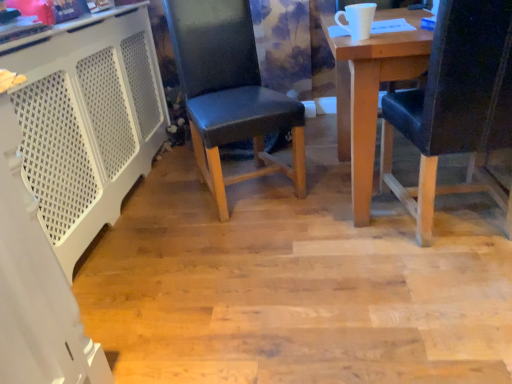
Question: In which direction should I rotate to look at black leather chair at center, placed as the 1th chair when sorted from left to right?

Choices:
 (A) right
 (B) left

Answer: (B)

Question: Is black leather chair at right, the 1th chair in the right-to-left sequence, positioned with its back to black leather chair at center, placed as the 1th chair when sorted from left to right?

Choices:
 (A) yes
 (B) no

Answer: (B)

Question: Is black leather chair at right, which is counted as the 2th chair, starting from the left, at the left side of black leather chair at center, marked as the second chair in a right-to-left arrangement?

Choices:
 (A) no
 (B) yes

Answer: (A)

Question: From a real-world perspective, is black leather chair at right, the 1th chair in the right-to-left sequence, over black leather chair at center, placed as the 1th chair when sorted from left to right?

Choices:
 (A) no
 (B) yes

Answer: (A)

Question: Is black leather chair at right, which is counted as the 2th chair, starting from the left, far away from black leather chair at center, marked as the second chair in a right-to-left arrangement?

Choices:
 (A) no
 (B) yes

Answer: (A)

Question: From the image's perspective, would you say black leather chair at right, which is counted as the 2th chair, starting from the left, is positioned over black leather chair at center, placed as the 1th chair when sorted from left to right?

Choices:
 (A) no
 (B) yes

Answer: (A)

Question: Does black leather chair at right, which is counted as the 2th chair, starting from the left, lie behind black leather chair at center, marked as the second chair in a right-to-left arrangement?

Choices:
 (A) yes
 (B) no

Answer: (B)

Question: Is black leather chair at right, the 1th chair in the right-to-left sequence, at the back of black leather chair at center, marked as the second chair in a right-to-left arrangement?

Choices:
 (A) yes
 (B) no

Answer: (B)

Question: Can you confirm if black leather chair at center, placed as the 1th chair when sorted from left to right, is shorter than black leather chair at right, the 1th chair in the right-to-left sequence?

Choices:
 (A) no
 (B) yes

Answer: (A)

Question: Are black leather chair at center, placed as the 1th chair when sorted from left to right, and black leather chair at right, which is counted as the 2th chair, starting from the left, making contact?

Choices:
 (A) no
 (B) yes

Answer: (A)

Question: From a real-world perspective, does black leather chair at center, marked as the second chair in a right-to-left arrangement, stand above black leather chair at right, the 1th chair in the right-to-left sequence?

Choices:
 (A) yes
 (B) no

Answer: (A)

Question: Considering the relative sizes of black leather chair at center, placed as the 1th chair when sorted from left to right, and black leather chair at right, the 1th chair in the right-to-left sequence, in the image provided, is black leather chair at center, placed as the 1th chair when sorted from left to right, wider than black leather chair at right, the 1th chair in the right-to-left sequence,?

Choices:
 (A) yes
 (B) no

Answer: (B)

Question: Could black leather chair at right, the 1th chair in the right-to-left sequence, be considered to be inside black leather chair at center, placed as the 1th chair when sorted from left to right?

Choices:
 (A) yes
 (B) no

Answer: (B)

Question: Is black leather chair at center, placed as the 1th chair when sorted from left to right, beside white perforated plastic at left?

Choices:
 (A) yes
 (B) no

Answer: (B)